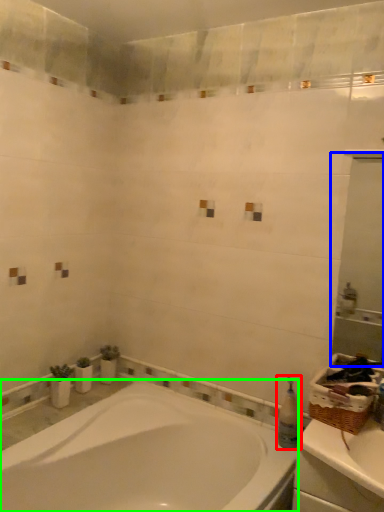
Question: Which object is positioned closest to toiletry (highlighted by a red box)? Select from mirror (highlighted by a blue box) and bathtub (highlighted by a green box).

Choices:
 (A) mirror
 (B) bathtub

Answer: (B)